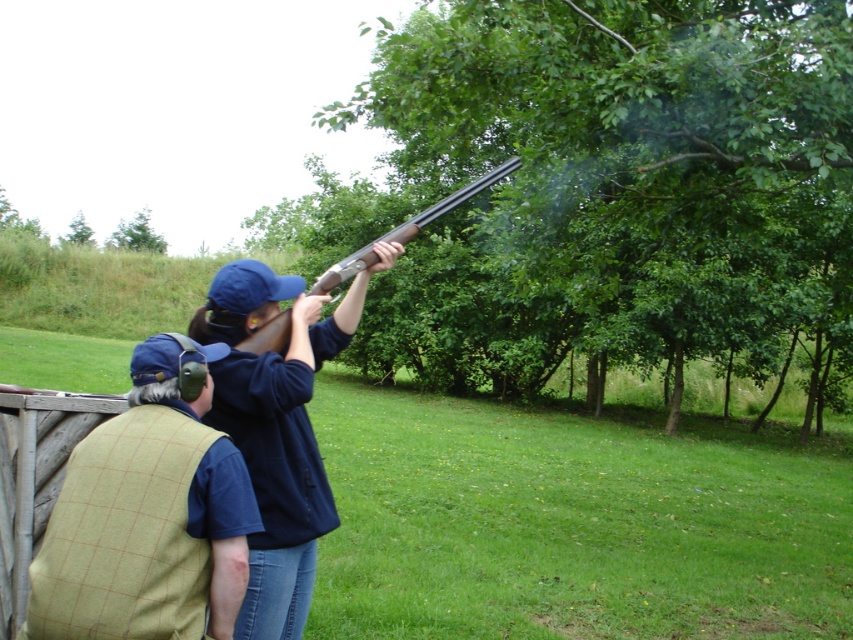
Based on the coordinates provided, which object is located at point (x=277, y=428) in the scene?

The point at (x=277, y=428) corresponds to the blue fabric shirt at upper center.

In the outdoor shooting scene, there is a person in the foreground wearing a blue cap and dark jacket holding a shotgun, and another person wearing a green checkered vest over a blue shirt. Where is the green tweed vest at center located in the image?

The green tweed vest at center is located at the 2D coordinates point [148,515] in the image.

You are standing at the shooting range and see the point marked at coordinates [212,600]. If you want to place a target 10 feet away from you, is the point too close or too far?

The point marked at coordinates [212,600] is 7.86 feet from the viewer, which is closer than the desired 10 feet. Therefore, the point is too close.